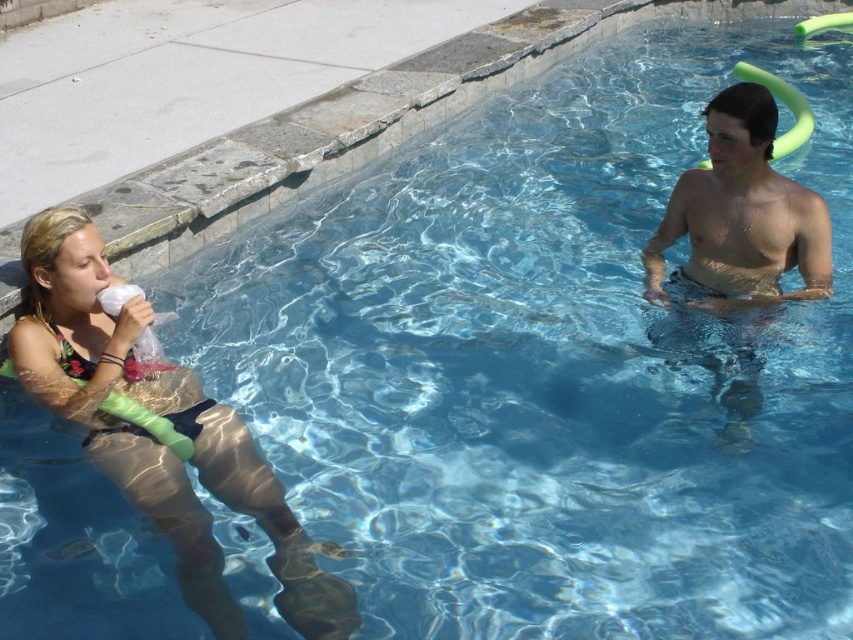
Measure the distance between matte green float at left and camera.

The distance of matte green float at left from camera is 9.49 feet.

Image resolution: width=853 pixels, height=640 pixels. I want to click on matte green float at left, so click(155, 440).